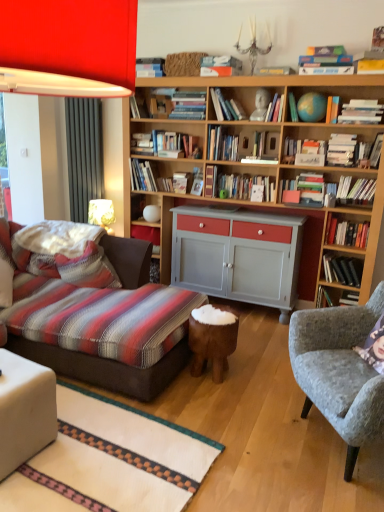
The image size is (384, 512). Find the location of `vacant area on top of hardcover book at center, which is the 19th book in right-to-left order (from a real-world perspective)`. vacant area on top of hardcover book at center, which is the 19th book in right-to-left order (from a real-world perspective) is located at coordinates 150,126.